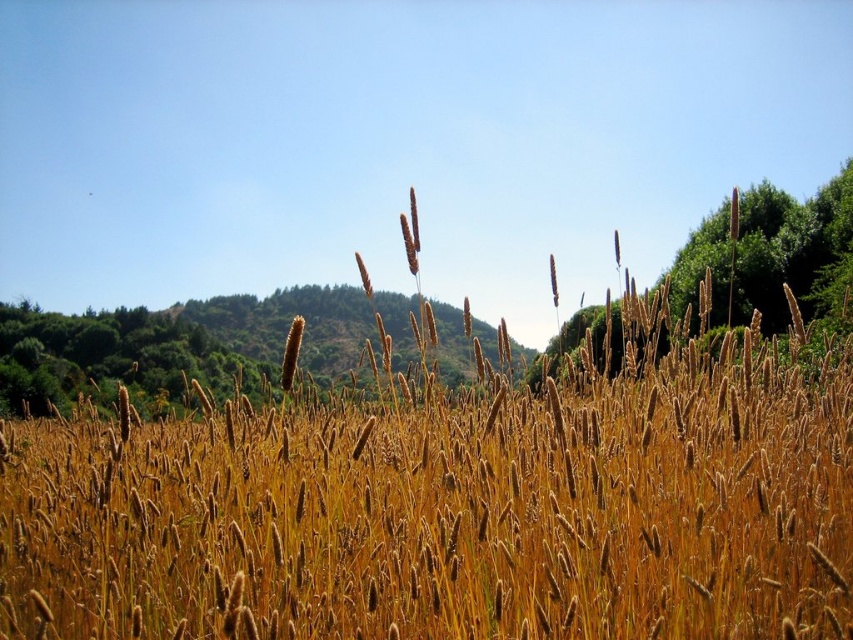
Find the location of a particular element. The image size is (853, 640). golden matte wheat field at center is located at coordinates (450, 515).

Between point (308, 621) and point (718, 225), which one is positioned behind?

The point (718, 225) is more distant.

Identify the location of golden matte wheat field at center. (450, 515).